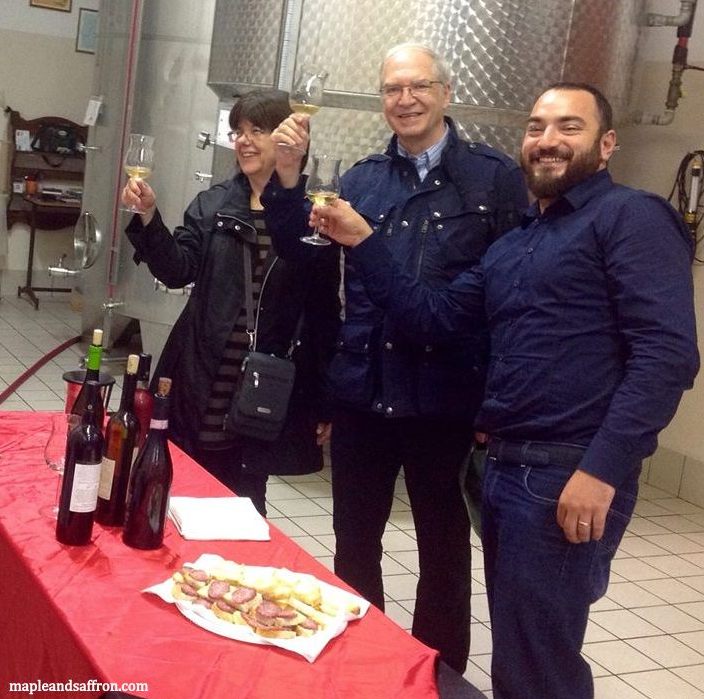
I want to click on red table cloth, so click(93, 586).